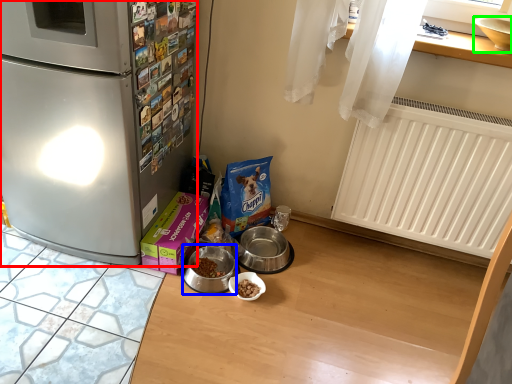
Question: Estimate the real-world distances between objects in this image. Which object is farther from refrigerator (highlighted by a red box), appliance (highlighted by a blue box) or appliance (highlighted by a green box)?

Choices:
 (A) appliance
 (B) appliance

Answer: (B)